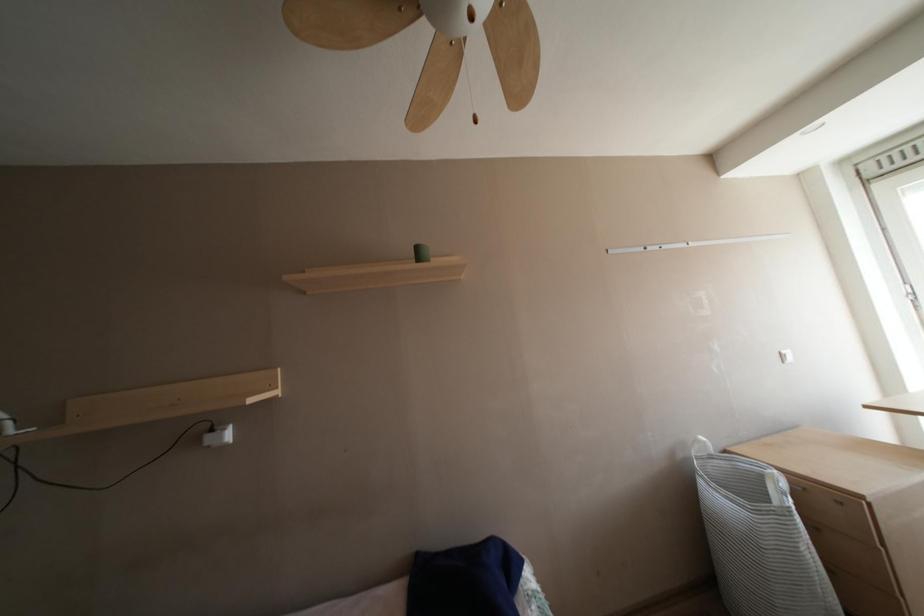
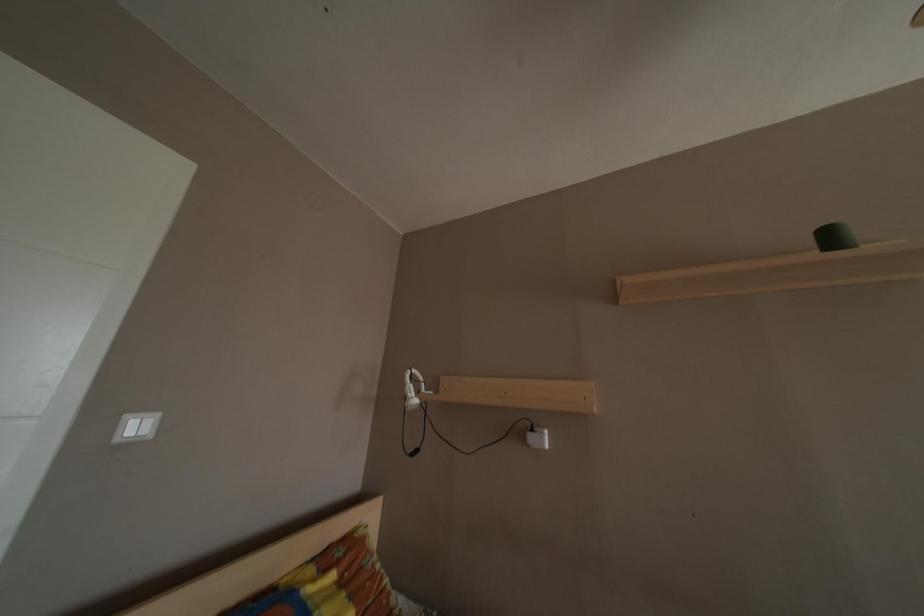
Question: Based on the continuous images, in which direction is the camera rotating? Reply with the corresponding letter.

Choices:
 (A) Left
 (B) Right
 (C) Up
 (D) Down

Answer: (A)